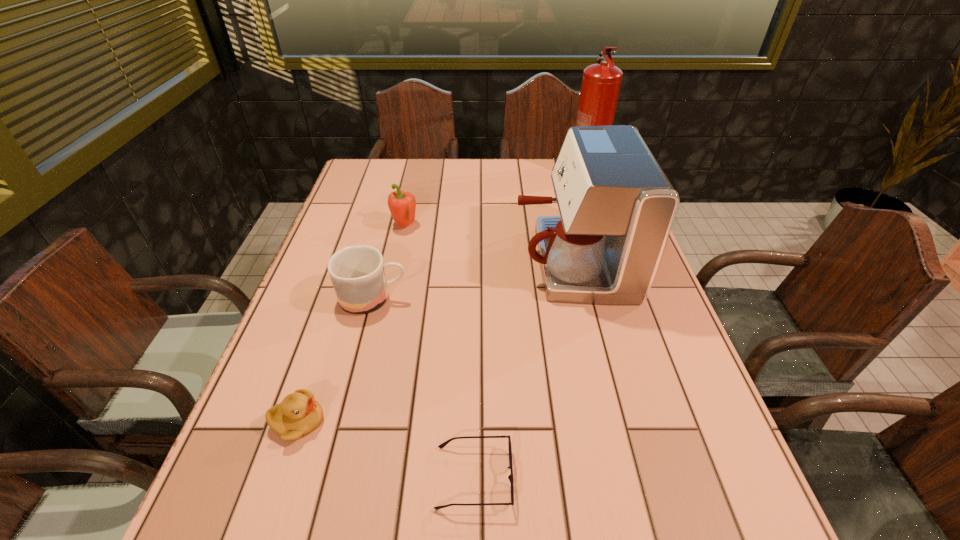
Locate an element on the screen. This screenshot has height=540, width=960. free spot located 0.300m on the front of the coffee maker near the spout is located at coordinates (402, 261).

I want to click on vacant area situated on the front of the coffee maker near the spout, so click(421, 261).

Identify the location of free location located 0.260m on the front of the pepper. The image size is (960, 540). click(389, 299).

You are a GUI agent. You are given a task and a screenshot of the screen. Output one action in this format:
    pyautogui.click(x=<x>, y=<y>)
    Task: Click on the free space located on the side with the handle of the mug
    
    Given the screenshot: What is the action you would take?
    pyautogui.click(x=450, y=298)

Image resolution: width=960 pixels, height=540 pixels. In order to click on free region located at the beak of the duckling in this screenshot , I will do `click(513, 422)`.

This screenshot has height=540, width=960. I want to click on free space located on the front-facing side of the fourth object from left to right, so click(x=666, y=477).

At what (x,y) coordinates should I click in order to perform the action: click on object situated at the far edge. Please return your answer as a coordinate pair (x, y). Looking at the image, I should click on (601, 82).

Where is `mug situated at the left edge`? mug situated at the left edge is located at coordinates (357, 273).

Image resolution: width=960 pixels, height=540 pixels. In order to click on duckling at the left edge in this screenshot , I will do `click(299, 414)`.

The height and width of the screenshot is (540, 960). Find the location of `fire extinguisher that is at the right edge`. fire extinguisher that is at the right edge is located at coordinates (601, 82).